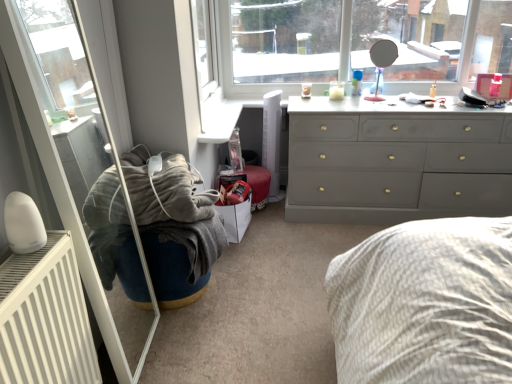
Question: Is dark blue fabric bean bag chair at center taller than white cardboard shoe box at lower center?

Choices:
 (A) yes
 (B) no

Answer: (B)

Question: Does dark blue fabric bean bag chair at center have a larger size compared to white cardboard shoe box at lower center?

Choices:
 (A) no
 (B) yes

Answer: (B)

Question: From a real-world perspective, is dark blue fabric bean bag chair at center located higher than white cardboard shoe box at lower center?

Choices:
 (A) yes
 (B) no

Answer: (A)

Question: Can you confirm if dark blue fabric bean bag chair at center is wider than white cardboard shoe box at lower center?

Choices:
 (A) yes
 (B) no

Answer: (A)

Question: Can you confirm if dark blue fabric bean bag chair at center is shorter than white cardboard shoe box at lower center?

Choices:
 (A) yes
 (B) no

Answer: (A)

Question: From a real-world perspective, relative to white metallic radiator at lower left, is white glossy radiator at left vertically above or below?

Choices:
 (A) below
 (B) above

Answer: (B)

Question: Is white glossy radiator at left taller or shorter than white metallic radiator at lower left?

Choices:
 (A) tall
 (B) short

Answer: (A)

Question: In terms of width, does white glossy radiator at left look wider or thinner when compared to white metallic radiator at lower left?

Choices:
 (A) wide
 (B) thin

Answer: (B)

Question: From the image's perspective, is white glossy radiator at left positioned above or below white metallic radiator at lower left?

Choices:
 (A) below
 (B) above

Answer: (B)

Question: Looking at their shapes, would you say dark blue fabric bean bag chair at center is wider or thinner than white metallic radiator at lower left?

Choices:
 (A) thin
 (B) wide

Answer: (B)

Question: From a real-world perspective, relative to white metallic radiator at lower left, is dark blue fabric bean bag chair at center vertically above or below?

Choices:
 (A) above
 (B) below

Answer: (B)

Question: Is dark blue fabric bean bag chair at center to the left or to the right of white metallic radiator at lower left in the image?

Choices:
 (A) right
 (B) left

Answer: (A)

Question: Is dark blue fabric bean bag chair at center inside the boundaries of white metallic radiator at lower left, or outside?

Choices:
 (A) outside
 (B) inside

Answer: (A)

Question: From a real-world perspective, is white cardboard shoe box at lower center physically located above or below dark blue fabric bean bag chair at center?

Choices:
 (A) above
 (B) below

Answer: (B)

Question: From the image's perspective, relative to dark blue fabric bean bag chair at center, is white cardboard shoe box at lower center above or below?

Choices:
 (A) below
 (B) above

Answer: (B)